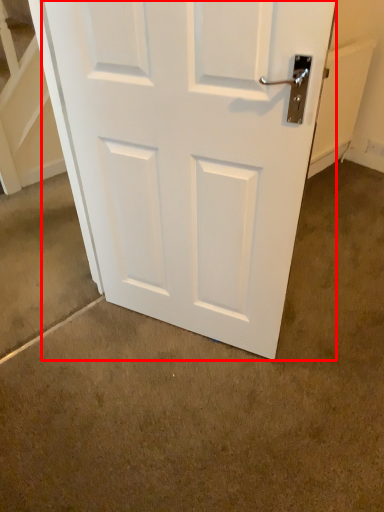
Question: From the image, what is the correct spatial relationship of door (annotated by the red box) in relation to concrete?

Choices:
 (A) left
 (B) right

Answer: (A)